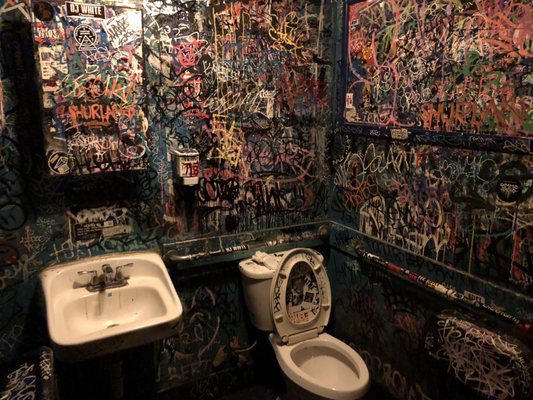
You are a GUI agent. You are given a task and a screenshot of the screen. Output one action in this format:
    pyautogui.click(x=<x>, y=<y>)
    Task: Click on the top front of toilet bowl rim
    
    Given the screenshot: What is the action you would take?
    pyautogui.click(x=351, y=385)